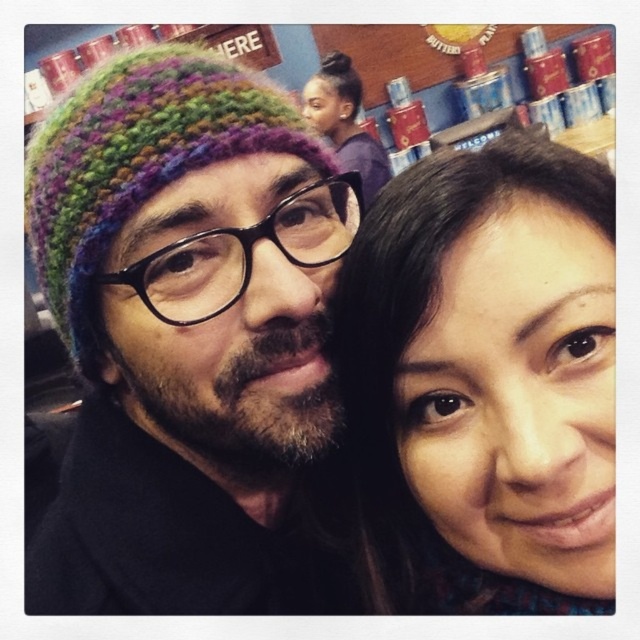
Does multicolored knitted hat at left have a lesser width compared to purple knit beanie at upper center?

Yes.

Between multicolored knitted hat at left and purple knit beanie at upper center, which one is positioned higher?

purple knit beanie at upper center

Which is behind, point (76, 259) or point (342, 168)?

Point (342, 168)

Where is `multicolored knitted hat at left`? The width and height of the screenshot is (640, 640). multicolored knitted hat at left is located at coordinates (189, 340).

Is point (486, 380) farther from camera compared to point (330, 104)?

No.

Does smooth brown hair at center appear on the left side of purple knit beanie at upper center?

No, smooth brown hair at center is not to the left of purple knit beanie at upper center.

From the picture: Who is more distant from viewer, (387, 465) or (310, 100)?

Positioned behind is point (310, 100).

Locate an element on the screen. The height and width of the screenshot is (640, 640). smooth brown hair at center is located at coordinates (484, 381).

Who is lower down, multicolored knitted hat at left or smooth brown hair at center?

smooth brown hair at center

Which is more to the right, multicolored knitted hat at left or smooth brown hair at center?

From the viewer's perspective, smooth brown hair at center appears more on the right side.

Identify the location of multicolored knitted hat at left. The width and height of the screenshot is (640, 640). (189, 340).